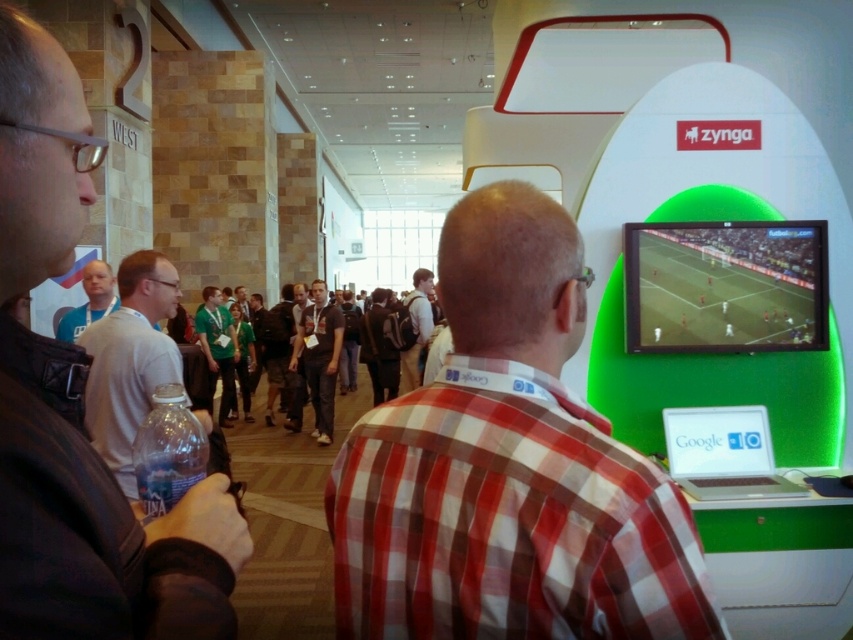
Does plaid shirt at center appear on the left side of brown leather backpack at center?

Incorrect, plaid shirt at center is not on the left side of brown leather backpack at center.

Who is positioned more to the left, plaid shirt at center or brown leather backpack at center?

From the viewer's perspective, brown leather backpack at center appears more on the left side.

Where is `plaid shirt at center`? This screenshot has height=640, width=853. plaid shirt at center is located at coordinates (508, 468).

Locate an element on the screen. plaid shirt at center is located at coordinates (508, 468).

Can you confirm if dark brown leather jacket at left is positioned below matte blue shirt at center?

Yes.

Is point (44, 276) farther from camera compared to point (86, 300)?

That is False.

Where is `dark brown leather jacket at left`? The width and height of the screenshot is (853, 640). dark brown leather jacket at left is located at coordinates (102, 540).

Is plaid shirt at center in front of gray fabric shirt at center?

That is True.

Can you confirm if plaid shirt at center is taller than gray fabric shirt at center?

No.

You are a GUI agent. You are given a task and a screenshot of the screen. Output one action in this format:
    pyautogui.click(x=<x>, y=<y>)
    Task: Click on the plaid shirt at center
    Image resolution: width=853 pixels, height=640 pixels.
    Given the screenshot: What is the action you would take?
    point(508,468)